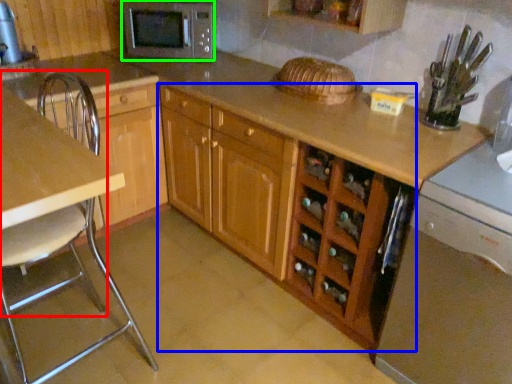
Question: Which is farther away from chair (highlighted by a red box)? cabinetry (highlighted by a blue box) or microwave oven (highlighted by a green box)?

Choices:
 (A) cabinetry
 (B) microwave oven

Answer: (A)